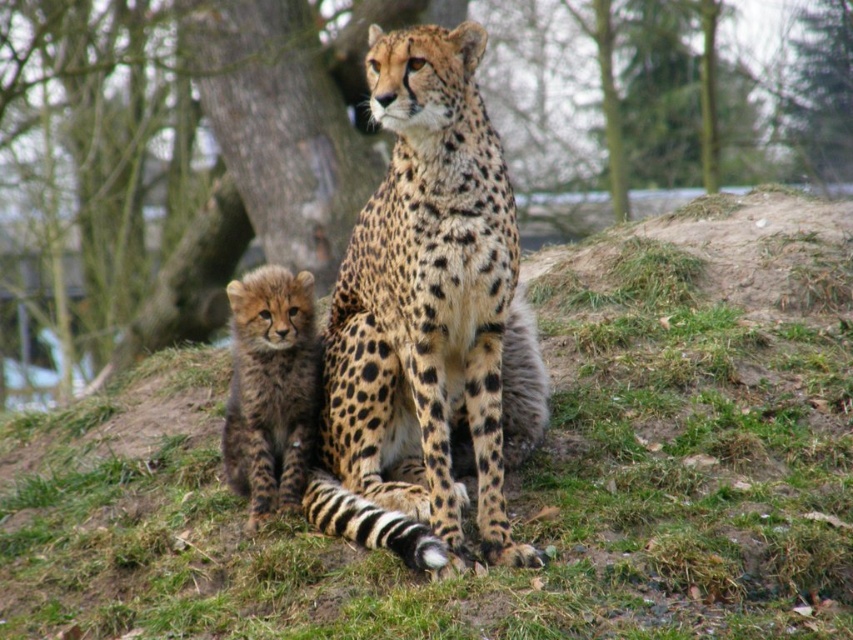
Question: Which of the following is the closest to the observer?

Choices:
 (A) (239, 308)
 (B) (540, 141)

Answer: (A)

Question: Does fuzzy green grass at center have a larger size compared to spotted fur cub at lower left?

Choices:
 (A) yes
 (B) no

Answer: (A)

Question: Which point is closer to the camera taking this photo?

Choices:
 (A) (276, 17)
 (B) (410, 369)

Answer: (B)

Question: Is fuzzy green grass at center further to the viewer compared to spotted fur cub at lower left?

Choices:
 (A) yes
 (B) no

Answer: (B)

Question: Which point is farther from the camera taking this photo?

Choices:
 (A) (300, 296)
 (B) (444, 140)
 (C) (782, 124)
 (D) (195, 417)

Answer: (C)

Question: Is fuzzy green grass at center behind spotted fur cheetah at center?

Choices:
 (A) no
 (B) yes

Answer: (A)